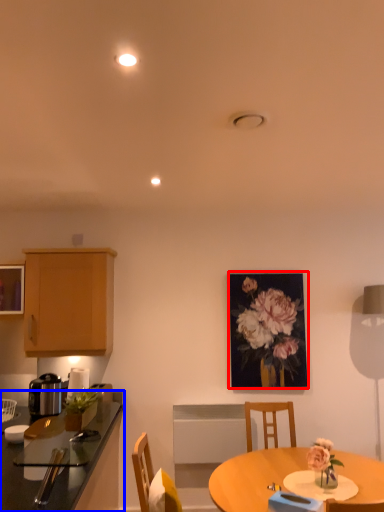
Question: Which object is further to the camera taking this photo, picture frame (highlighted by a red box) or countertop (highlighted by a blue box)?

Choices:
 (A) picture frame
 (B) countertop

Answer: (A)